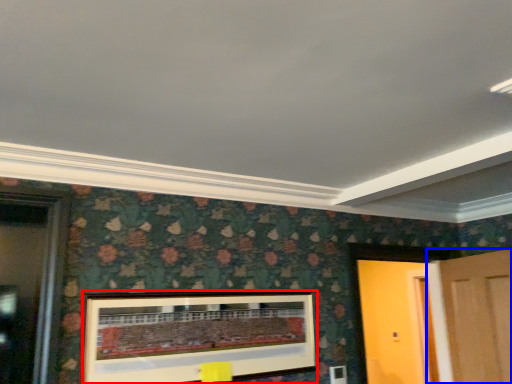
Question: Which object appears farthest to the camera in this image, picture frame (highlighted by a red box) or door (highlighted by a blue box)?

Choices:
 (A) picture frame
 (B) door

Answer: (B)